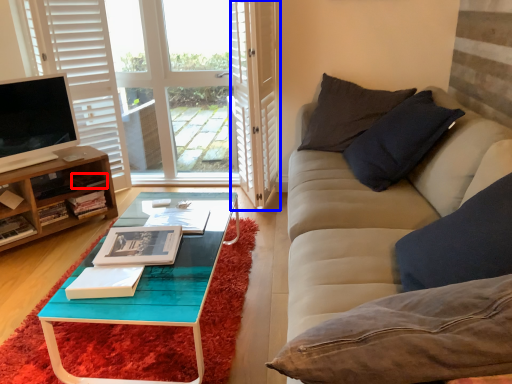
Question: Among these objects, which one is farthest to the camera, book (highlighted by a red box) or screen door (highlighted by a blue box)?

Choices:
 (A) book
 (B) screen door

Answer: (A)